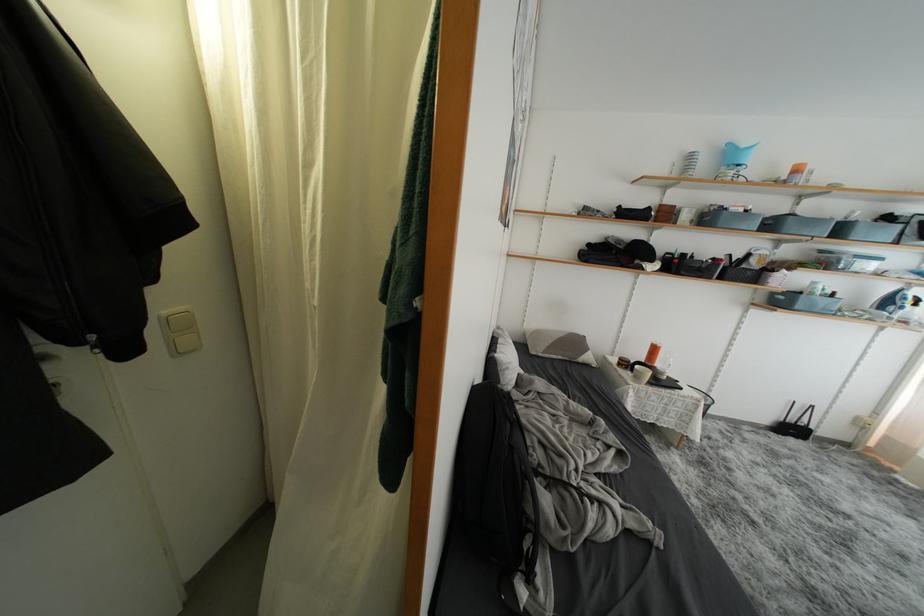
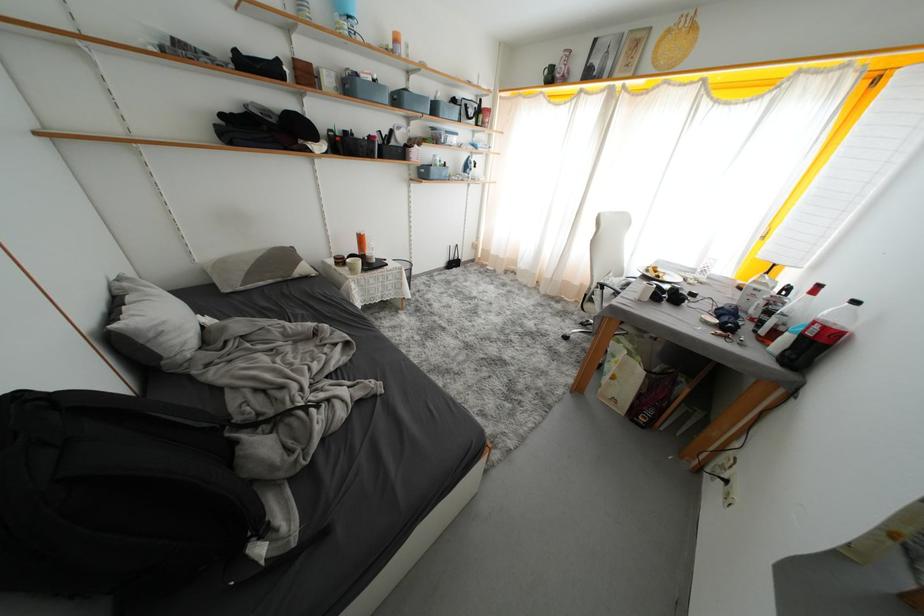
Find the pixel in the second image that matches pixel 752 215 in the first image.

(381, 84)